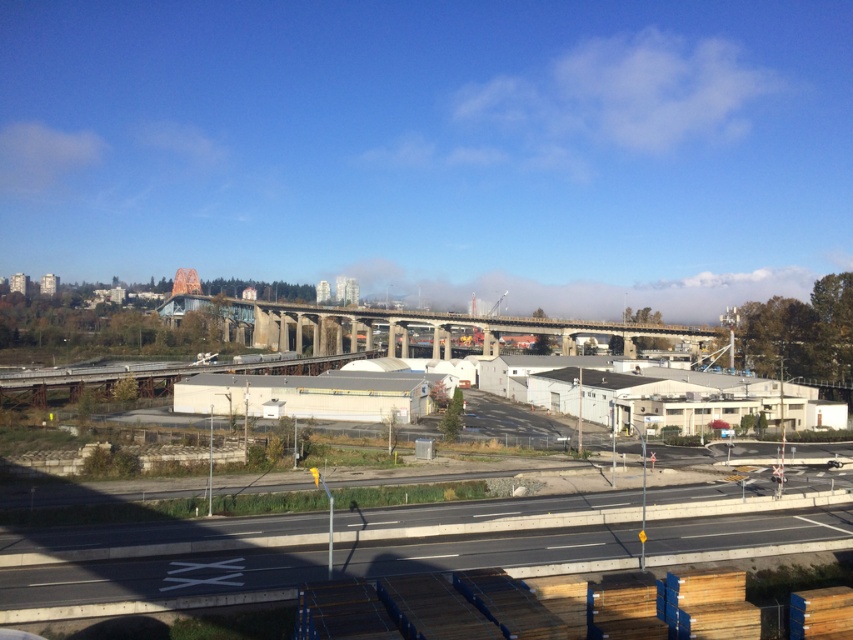
Question: Is smooth asphalt highway at lower center behind concrete bridge at center?

Choices:
 (A) yes
 (B) no

Answer: (B)

Question: Which point is closer to the camera?

Choices:
 (A) (523, 321)
 (B) (276, 356)
 (C) (606, 532)

Answer: (C)

Question: Is concrete bridge at center bigger than gray concrete train track at lower center?

Choices:
 (A) no
 (B) yes

Answer: (B)

Question: Which object is positioned closest to the smooth asphalt highway at lower center?

Choices:
 (A) concrete bridge at center
 (B) gray concrete train track at lower center

Answer: (B)

Question: Which of the following is the closest to the observer?

Choices:
 (A) smooth asphalt highway at lower center
 (B) gray concrete train track at lower center
 (C) concrete bridge at center

Answer: (A)

Question: Does concrete bridge at center appear on the left side of gray concrete train track at lower center?

Choices:
 (A) no
 (B) yes

Answer: (A)